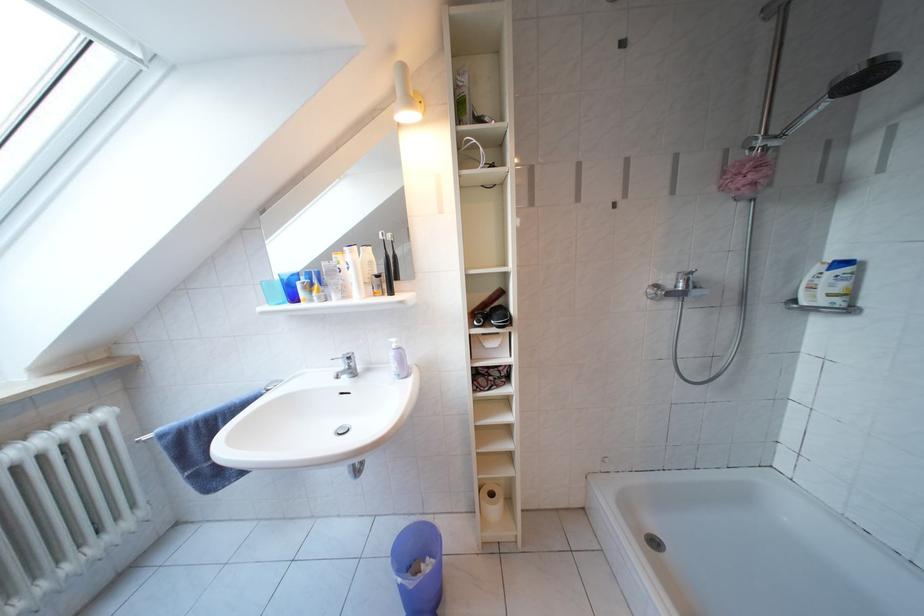
You are a GUI agent. You are given a task and a screenshot of the screen. Output one action in this format:
    pyautogui.click(x=<x>, y=<y>)
    Task: Click on the handheld shower head
    This screenshot has height=616, width=924.
    Given the screenshot: What is the action you would take?
    [864, 75]